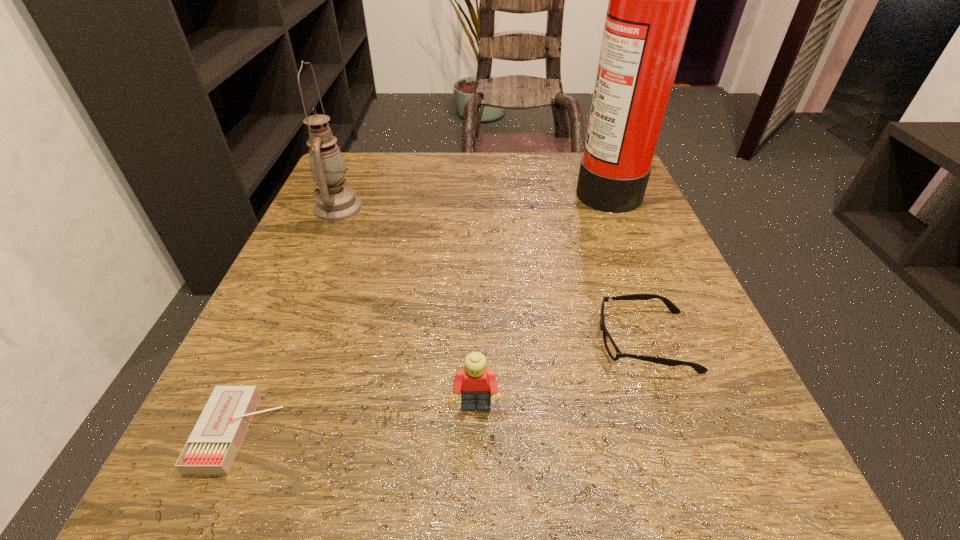
Identify the location of free space located on the front of the second tallest object. (302, 290).

You are a GUI agent. You are given a task and a screenshot of the screen. Output one action in this format:
    pyautogui.click(x=<x>, y=<y>)
    Task: Click on the vacant space located on the face of the third shortest object
    
    Given the screenshot: What is the action you would take?
    pyautogui.click(x=475, y=474)

The image size is (960, 540). In order to click on free space located on the front-facing side of the third farthest object in this screenshot , I will do `click(378, 341)`.

Image resolution: width=960 pixels, height=540 pixels. What are the coordinates of `free space located on the front-facing side of the third farthest object` in the screenshot? It's located at click(x=372, y=341).

Locate an element on the screen. This screenshot has width=960, height=540. blank area located on the front-facing side of the third farthest object is located at coordinates [x=465, y=341].

At what (x,y) coordinates should I click in order to perform the action: click on free space located 0.050m on the striking surface of the shortest object. Please return your answer as a coordinate pair (x, y). The width and height of the screenshot is (960, 540). Looking at the image, I should click on (315, 433).

The height and width of the screenshot is (540, 960). I want to click on fire extinguisher positioned at the far edge, so click(651, 0).

Where is `oil lamp present at the far edge`? The width and height of the screenshot is (960, 540). oil lamp present at the far edge is located at coordinates (334, 202).

At what (x,y) coordinates should I click in order to perform the action: click on object positioned at the near edge. Please return your answer as a coordinate pair (x, y). This screenshot has width=960, height=540. Looking at the image, I should click on (211, 448).

Where is `oil lamp that is positioned at the left edge`? The image size is (960, 540). oil lamp that is positioned at the left edge is located at coordinates (334, 202).